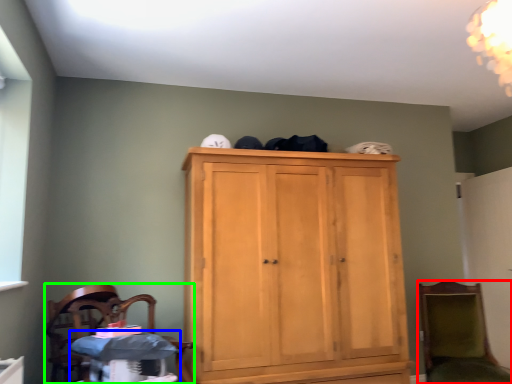
Question: Considering the real-world distances, which object is closest to chair (highlighted by a red box)? changing table (highlighted by a blue box) or chair (highlighted by a green box).

Choices:
 (A) changing table
 (B) chair

Answer: (A)